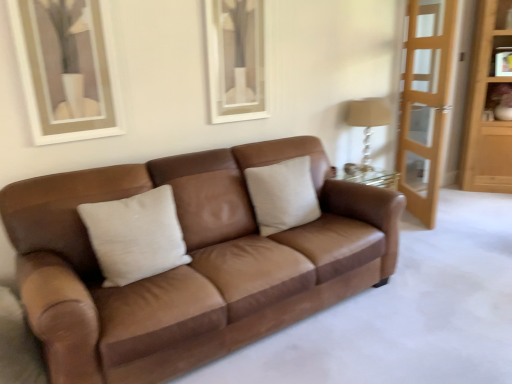
Question: Can you confirm if light wood screen door at right is wider than light brown wooden dresser at right?

Choices:
 (A) yes
 (B) no

Answer: (B)

Question: Is light wood screen door at right located outside light brown wooden dresser at right?

Choices:
 (A) no
 (B) yes

Answer: (B)

Question: Is there a large distance between light wood screen door at right and light brown wooden dresser at right?

Choices:
 (A) no
 (B) yes

Answer: (B)

Question: From the image's perspective, does light wood screen door at right appear lower than light brown wooden dresser at right?

Choices:
 (A) yes
 (B) no

Answer: (A)

Question: Considering the relative sizes of light wood screen door at right and light brown wooden dresser at right in the image provided, is light wood screen door at right shorter than light brown wooden dresser at right?

Choices:
 (A) no
 (B) yes

Answer: (B)

Question: From the image's perspective, is light wood screen door at right above or below beige fabric lampshade at right?

Choices:
 (A) above
 (B) below

Answer: (A)

Question: Considering the positions of light wood screen door at right and beige fabric lampshade at right in the image, is light wood screen door at right wider or thinner than beige fabric lampshade at right?

Choices:
 (A) thin
 (B) wide

Answer: (A)

Question: In terms of size, does light wood screen door at right appear bigger or smaller than beige fabric lampshade at right?

Choices:
 (A) big
 (B) small

Answer: (A)

Question: Considering their positions, is light wood screen door at right located in front of or behind beige fabric lampshade at right?

Choices:
 (A) front
 (B) behind

Answer: (A)

Question: From the image's perspective, is matte brown vase at upper right above or below light wood screen door at right?

Choices:
 (A) above
 (B) below

Answer: (A)

Question: In terms of size, does matte brown vase at upper right appear bigger or smaller than light wood screen door at right?

Choices:
 (A) small
 (B) big

Answer: (A)

Question: Considering the positions of matte brown vase at upper right and light wood screen door at right in the image, is matte brown vase at upper right taller or shorter than light wood screen door at right?

Choices:
 (A) short
 (B) tall

Answer: (A)

Question: Considering the relative positions of matte brown vase at upper right and light wood screen door at right in the image provided, is matte brown vase at upper right to the left or to the right of light wood screen door at right?

Choices:
 (A) right
 (B) left

Answer: (A)

Question: Is beige fabric pillow at center in front of or behind light wood screen door at right in the image?

Choices:
 (A) behind
 (B) front

Answer: (B)

Question: From the image's perspective, relative to light wood screen door at right, is beige fabric pillow at center above or below?

Choices:
 (A) below
 (B) above

Answer: (A)